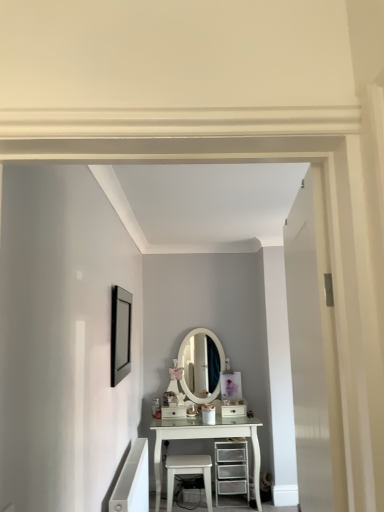
Question: Which direction should I rotate to look at white glossy drawer at center, marked as the 2th drawer in a right-to-left arrangement, — up or down?

Choices:
 (A) down
 (B) up

Answer: (A)

Question: Can you confirm if white glossy stool at lower center is positioned to the right of clear plastic drawers at center?

Choices:
 (A) yes
 (B) no

Answer: (B)

Question: Can you see white glossy stool at lower center touching clear plastic drawers at center?

Choices:
 (A) yes
 (B) no

Answer: (B)

Question: Considering the relative positions of white glossy stool at lower center and clear plastic drawers at center in the image provided, is white glossy stool at lower center to the left of clear plastic drawers at center from the viewer's perspective?

Choices:
 (A) no
 (B) yes

Answer: (B)

Question: Can you confirm if white glossy stool at lower center is thinner than clear plastic drawers at center?

Choices:
 (A) yes
 (B) no

Answer: (A)

Question: Would you consider white glossy stool at lower center to be distant from clear plastic drawers at center?

Choices:
 (A) yes
 (B) no

Answer: (B)

Question: Is white glossy stool at lower center outside of clear plastic drawers at center?

Choices:
 (A) no
 (B) yes

Answer: (B)

Question: Is white glossy drawer at center, marked as the first drawer in a left-to-right arrangement, taller than white glossy stool at lower center?

Choices:
 (A) no
 (B) yes

Answer: (A)

Question: Does white glossy drawer at center, marked as the first drawer in a left-to-right arrangement, have a larger size compared to white glossy stool at lower center?

Choices:
 (A) no
 (B) yes

Answer: (A)

Question: Is white glossy drawer at center, marked as the 2th drawer in a right-to-left arrangement, positioned far away from white glossy stool at lower center?

Choices:
 (A) no
 (B) yes

Answer: (A)

Question: From a real-world perspective, is white glossy drawer at center, marked as the 2th drawer in a right-to-left arrangement, positioned over white glossy stool at lower center based on gravity?

Choices:
 (A) yes
 (B) no

Answer: (A)

Question: Is white glossy drawer at center, marked as the 2th drawer in a right-to-left arrangement, turned away from white glossy stool at lower center?

Choices:
 (A) no
 (B) yes

Answer: (A)

Question: Is white glossy drawer at center, marked as the first drawer in a left-to-right arrangement, outside of white glossy stool at lower center?

Choices:
 (A) no
 (B) yes

Answer: (B)

Question: Could you tell me if white glossy stool at lower center is facing matte black picture frame at upper left?

Choices:
 (A) yes
 (B) no

Answer: (B)